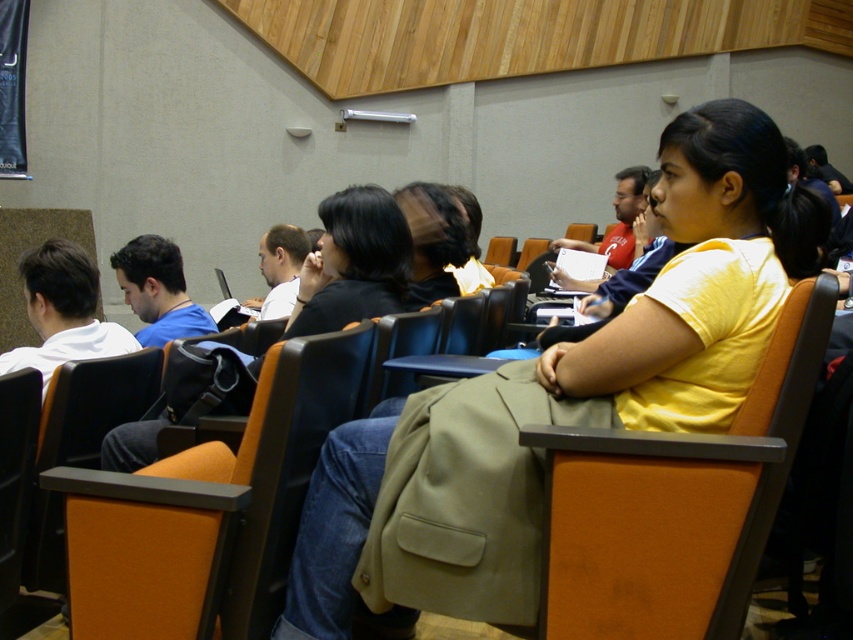
Question: Which of the following is the farthest from the observer?

Choices:
 (A) (367, 216)
 (B) (242, 506)
 (C) (335, 438)
 (D) (788, 305)

Answer: (A)

Question: Estimate the real-world distances between objects in this image. Which object is closer to the yellow matte shirt at center?

Choices:
 (A) orange fabric chair at left
 (B) matte black jacket at center

Answer: (A)

Question: Among these points, which one is nearest to the camera?

Choices:
 (A) (718, 614)
 (B) (120, 468)
 (C) (708, 408)
 (D) (189, 592)

Answer: (A)

Question: Can you confirm if orange fabric chair at left is smaller than matte black jacket at center?

Choices:
 (A) yes
 (B) no

Answer: (B)

Question: Does orange leather chair at center appear under orange fabric chair at left?

Choices:
 (A) no
 (B) yes

Answer: (A)

Question: Can you confirm if yellow matte shirt at center is thinner than orange leather chair at center?

Choices:
 (A) yes
 (B) no

Answer: (B)